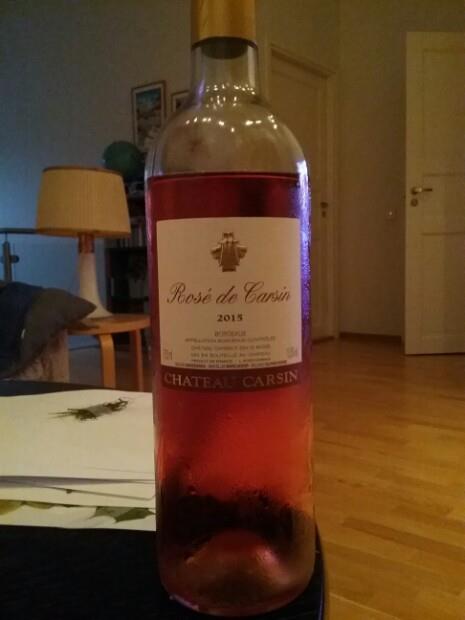
Find the location of a particular element. white wall is located at coordinates [128, 40], [29, 167].